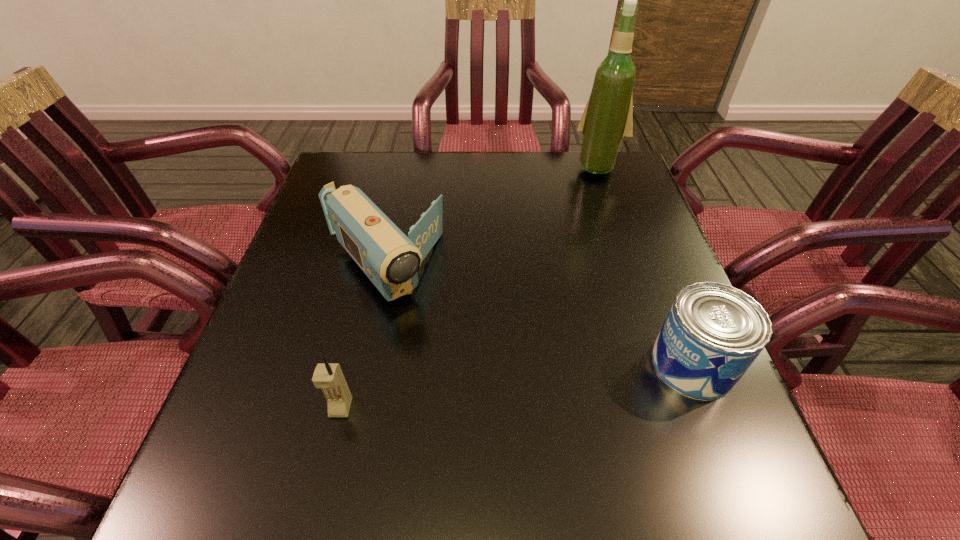
What are the coordinates of `free space located on the front-facing side of the wine bottle` in the screenshot? It's located at (570, 228).

Where is `vacant space located on the side of the second farthest object with the flip-out screen`? The height and width of the screenshot is (540, 960). vacant space located on the side of the second farthest object with the flip-out screen is located at coordinates (450, 354).

What are the coordinates of `vacant area situated 0.270m on the side of the second farthest object with the flip-out screen` in the screenshot? It's located at pyautogui.click(x=492, y=402).

Identify the location of vacant region located 0.290m on the side of the second farthest object with the flip-out screen. (499, 411).

At what (x,y) coordinates should I click in order to perform the action: click on object positioned at the far edge. Please return your answer as a coordinate pair (x, y). Looking at the image, I should click on (607, 121).

Where is `cellular telephone located at the near edge`? The width and height of the screenshot is (960, 540). cellular telephone located at the near edge is located at coordinates (329, 377).

Identify the location of can that is at the near edge. (713, 332).

Locate an element on the screen. The height and width of the screenshot is (540, 960). object situated at the left edge is located at coordinates (390, 259).

Where is `can located in the right edge section of the desktop`? This screenshot has width=960, height=540. can located in the right edge section of the desktop is located at coordinates (713, 332).

At what (x,y) coordinates should I click in order to perform the action: click on wine bottle situated at the right edge. Please return your answer as a coordinate pair (x, y). The image size is (960, 540). Looking at the image, I should click on (607, 121).